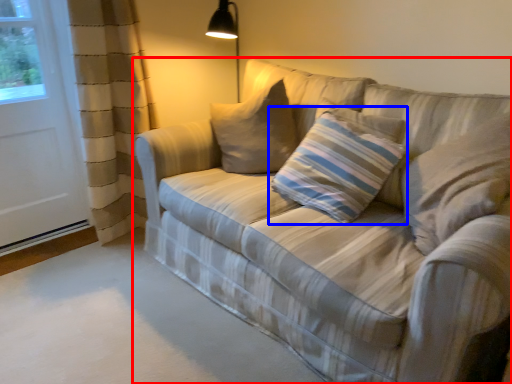
Question: Which point is closer to the camera, studio couch (highlighted by a red box) or pillow (highlighted by a blue box)?

Choices:
 (A) studio couch
 (B) pillow

Answer: (A)